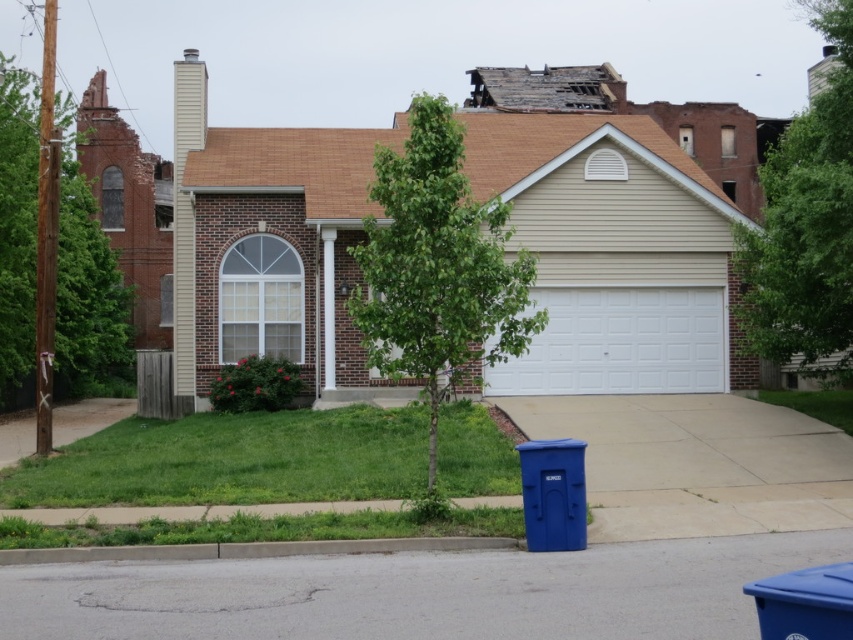
You are standing at the front door of the house and want to place a new flower pot between the green leafy tree at upper right and the camera. The flower pot requires a minimum of 15 meters of space. Is there enough space?

The distance between the green leafy tree at upper right and the camera is 15.15 meters, which is more than the required 15 meters. Therefore, there is enough space to place the flower pot.

You are a delivery person trying to park your van in front of the house. The van needs to be positioned so that it doesn not block the gray concrete curb at lower center. Based on the image, where should you place the van relative to the green leafy tree at upper right?

The green leafy tree at upper right is above the gray concrete curb at lower center, so to avoid blocking the curb, you should park the van below the green leafy tree at upper right.